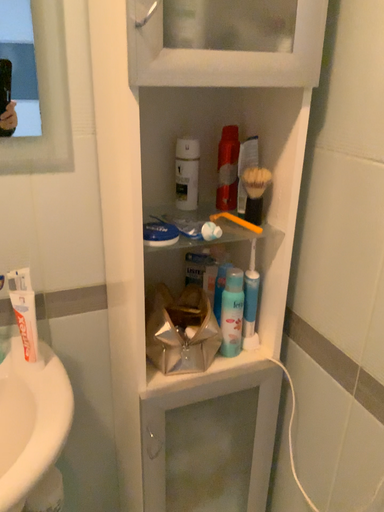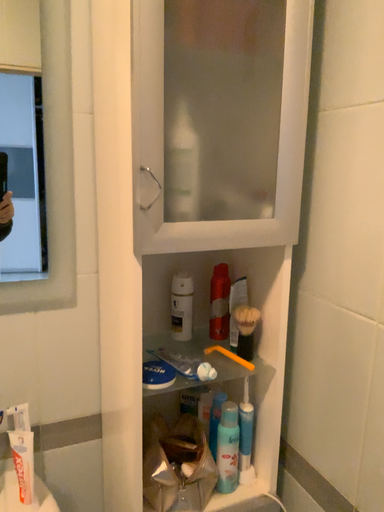
Question: How did the camera likely rotate when shooting the video?

Choices:
 (A) rotated upward
 (B) rotated downward

Answer: (A)